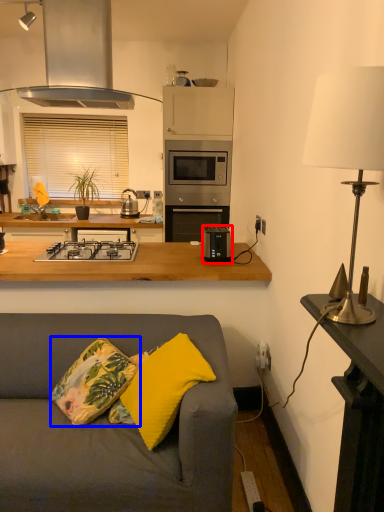
Question: Which object appears farthest to the camera in this image, toaster (highlighted by a red box) or throw pillow (highlighted by a blue box)?

Choices:
 (A) toaster
 (B) throw pillow

Answer: (A)